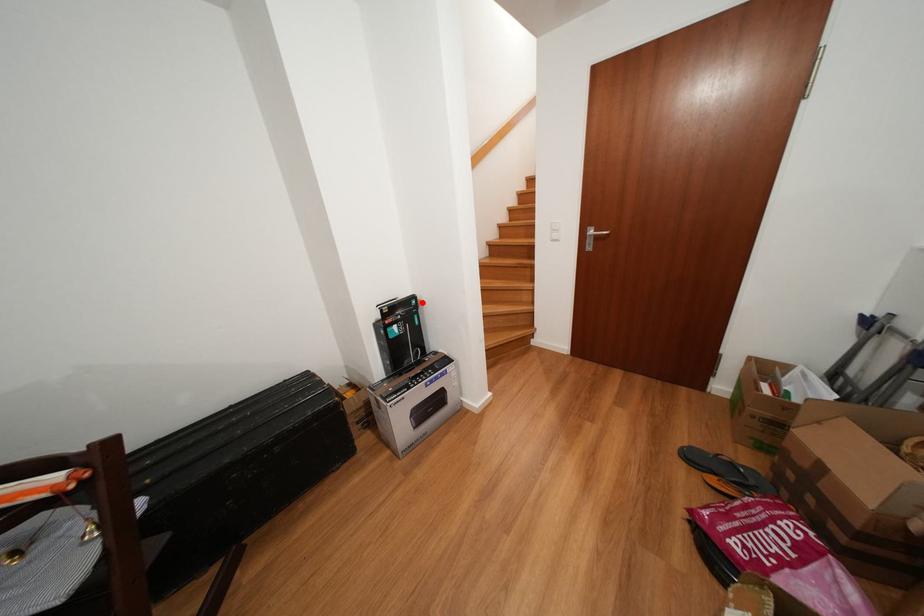
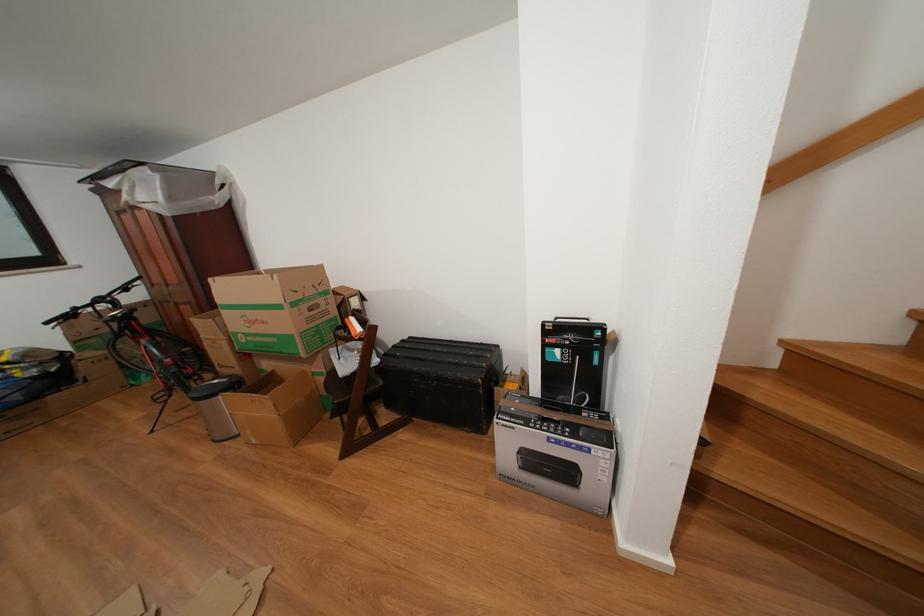
Where in the second image is the point corresponding to the highlighted location from the first image?

(611, 333)